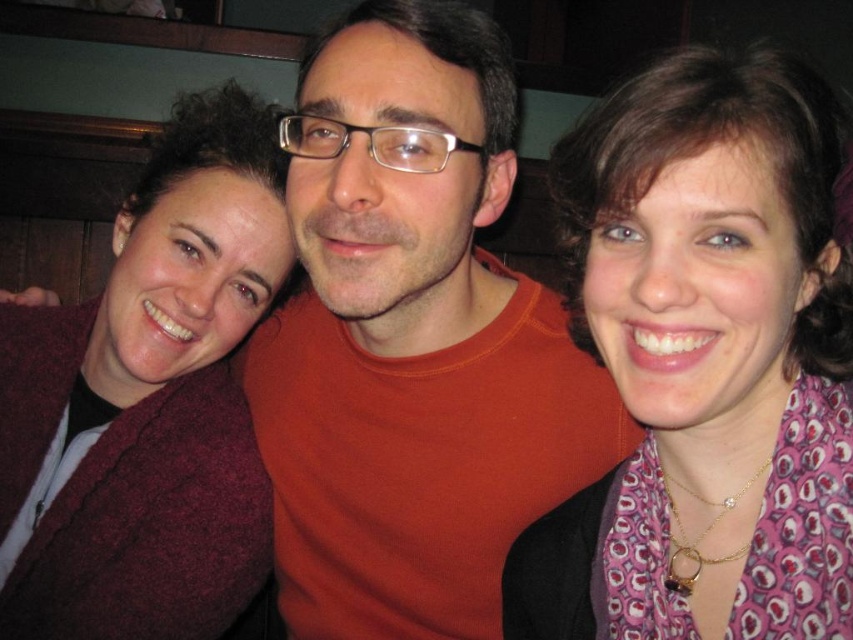
Looking at this image, you are trying to decide which item to grab first from the photo. Based on their widths, which of the two items, the purple patterned scarf at center or the maroon sweater at left, is narrower?

The purple patterned scarf at center has a lesser width compared to the maroon sweater at left, so the purple patterned scarf at center is narrower.